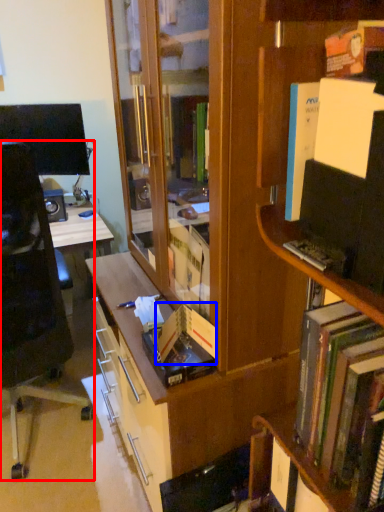
Question: Which object is closer to the camera taking this photo, chair (highlighted by a red box) or paperback book (highlighted by a blue box)?

Choices:
 (A) chair
 (B) paperback book

Answer: (B)